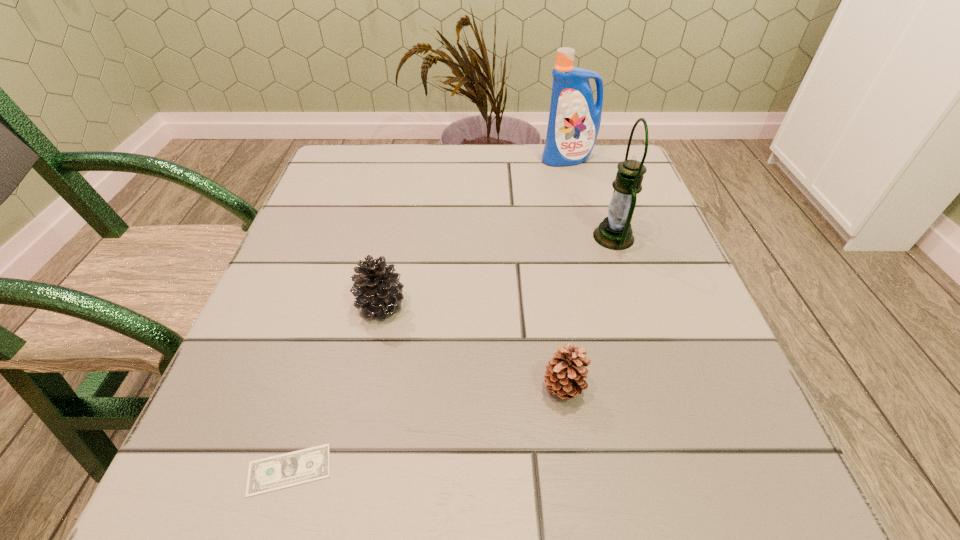
You are a GUI agent. You are given a task and a screenshot of the screen. Output one action in this format:
    pyautogui.click(x=<x>, y=<y>)
    Task: Click on the detergent
    The height and width of the screenshot is (540, 960).
    Given the screenshot: What is the action you would take?
    pyautogui.click(x=574, y=121)

You are a GUI agent. You are given a task and a screenshot of the screen. Output one action in this format:
    pyautogui.click(x=<x>, y=<y>)
    Task: Click on the lantern
    
    Given the screenshot: What is the action you would take?
    614,232

Locate an element on the screen. The image size is (960, 540). the third tallest object is located at coordinates pos(377,289).

Where is `the third nearest object`? The image size is (960, 540). the third nearest object is located at coordinates pyautogui.click(x=377, y=289).

At what (x,y) coordinates should I click in order to perform the action: click on the fourth farthest object. Please return your answer as a coordinate pair (x, y). This screenshot has height=540, width=960. Looking at the image, I should click on (565, 374).

Locate an element on the screen. This screenshot has height=540, width=960. the shorter pinecone is located at coordinates [565, 374].

At what (x,y) coordinates should I click in order to perform the action: click on money. Please return your answer as a coordinate pair (x, y). The height and width of the screenshot is (540, 960). Looking at the image, I should click on (273, 473).

I want to click on the shortest object, so click(273, 473).

I want to click on vacant space situated on the label of the farthest object, so click(x=574, y=183).

Locate an element on the screen. free region located on the side where the fourth nearest object emits light is located at coordinates (484, 237).